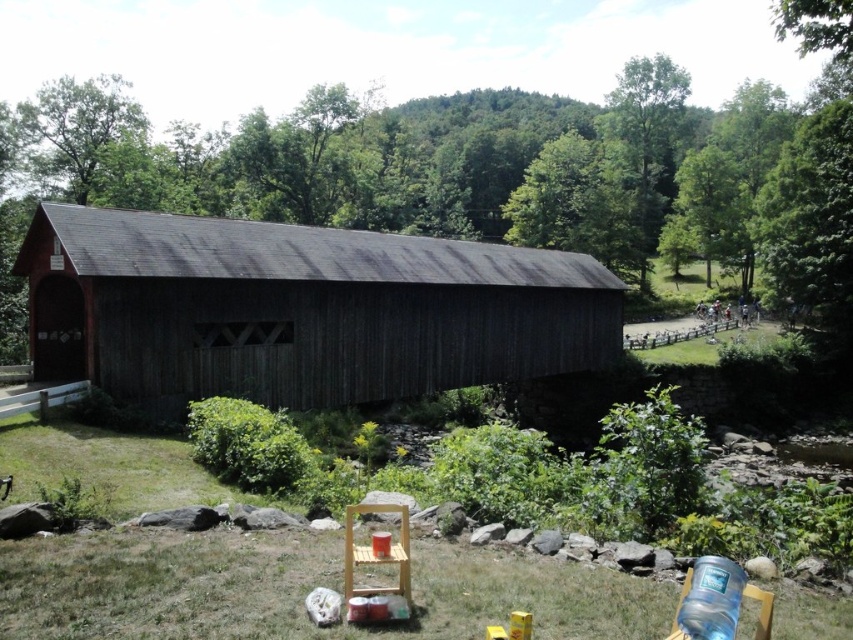
Which is above, dark brown wooden bridge at center or green grass at lower center?

dark brown wooden bridge at center

Looking at this image, which is below, dark brown wooden bridge at center or green grass at lower center?

green grass at lower center

This screenshot has height=640, width=853. Identify the location of dark brown wooden bridge at center. (299, 308).